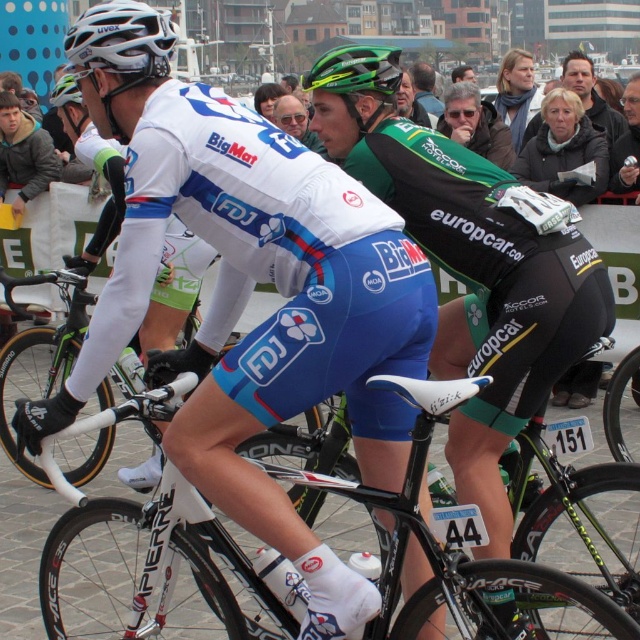
What are the coordinates of the matte white bicycle at center?

The coordinates of the matte white bicycle at center are at point [266,320].

You are a photographer positioned at the side of the race track. You need to capture a photo of both the matte white bicycle at center and the green matte helmet at upper center. Which object should you focus on first to ensure both are in sharp focus?

The matte white bicycle at center is closer to the viewer than the green matte helmet at upper center. To ensure both are in sharp focus, focus on the matte white bicycle at center first since it is closer, and the depth of field will naturally include the helmet in the background.

You are a photographer standing at the side of the road during a cycling race. You need to capture a photo of both the matte white bicycle at center and the green matte helmet at upper center in the same frame. Based on their sizes in the image, which object would appear larger in your photo?

The matte white bicycle at center is much taller than the green matte helmet at upper center, so it would appear larger in the photo.